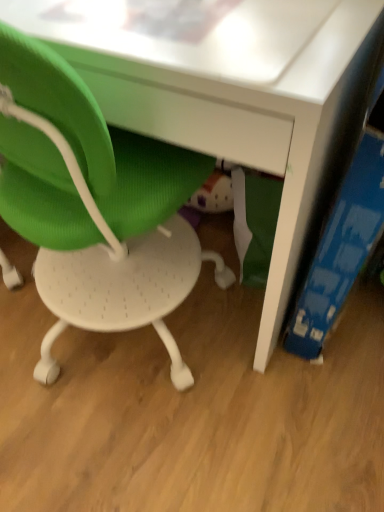
You are a GUI agent. You are given a task and a screenshot of the screen. Output one action in this format:
    pyautogui.click(x=<x>, y=<y>)
    Task: Click on the vacant area in front of green mesh chair at lower left
    This screenshot has height=512, width=384.
    Given the screenshot: What is the action you would take?
    pyautogui.click(x=127, y=453)